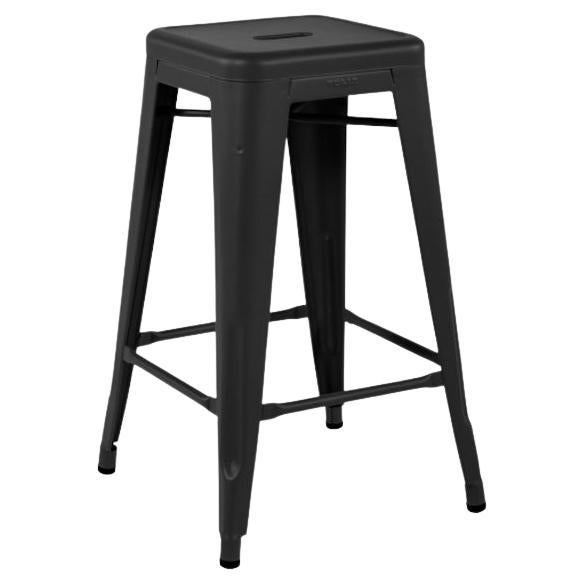
This screenshot has height=584, width=584. Find the location of `support beams`. support beams is located at coordinates (376, 123), (187, 112).